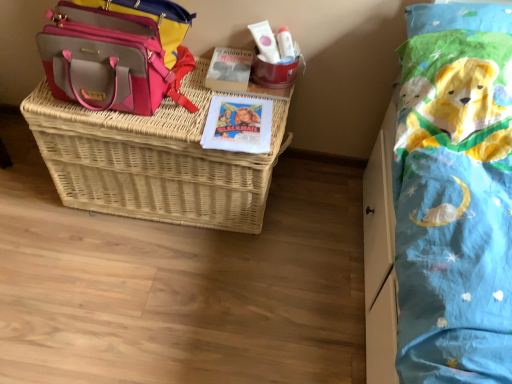
Question: Is woven wicker basket at center spatially inside white matte tube at upper center, or outside of it?

Choices:
 (A) outside
 (B) inside

Answer: (A)

Question: Relative to white matte tube at upper center, is woven wicker basket at center in front or behind?

Choices:
 (A) behind
 (B) front

Answer: (B)

Question: Which object is positioned farthest from the white matte tube at upper center?

Choices:
 (A) pink leather shoulder bag at upper left
 (B) woven wicker basket at center

Answer: (B)

Question: Which is nearer to the pink leather shoulder bag at upper left?

Choices:
 (A) woven wicker basket at center
 (B) white matte tube at upper center

Answer: (A)